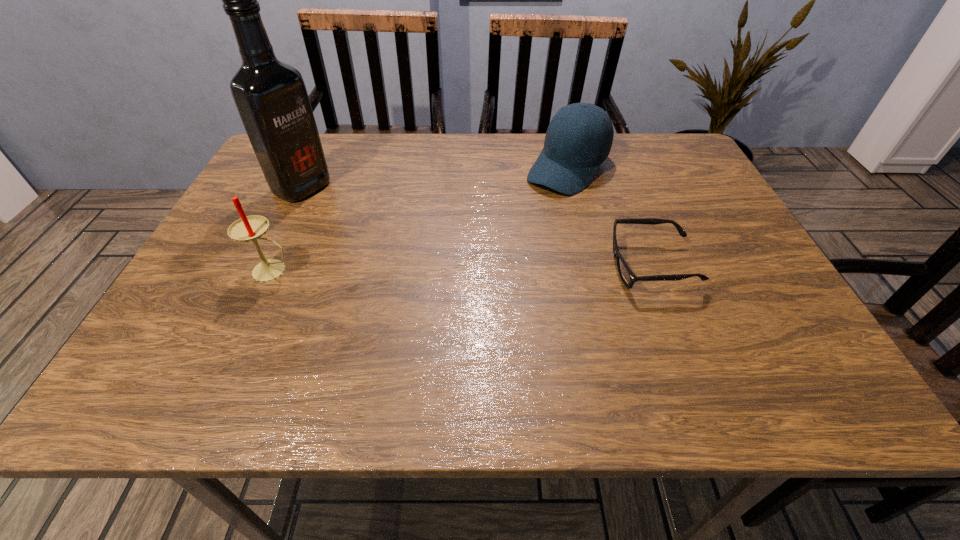
The width and height of the screenshot is (960, 540). Find the location of `free spot that satisfies the following two spatial constraints: 1. on the back side of the liquor; 2. on the left side of the second shortest object`. free spot that satisfies the following two spatial constraints: 1. on the back side of the liquor; 2. on the left side of the second shortest object is located at coordinates (311, 168).

Where is `vacant region that satisfies the following two spatial constraints: 1. on the front side of the candle; 2. on the left side of the liquor`? vacant region that satisfies the following two spatial constraints: 1. on the front side of the candle; 2. on the left side of the liquor is located at coordinates (261, 271).

This screenshot has height=540, width=960. What are the coordinates of `vacant space that satisfies the following two spatial constraints: 1. on the back side of the third shortest object; 2. on the right side of the second shortest object` in the screenshot? It's located at (320, 168).

This screenshot has width=960, height=540. In order to click on free space that satisfies the following two spatial constraints: 1. on the front side of the tallest object; 2. on the front-facing side of the sunglasses in this screenshot , I will do `click(263, 266)`.

Locate an element on the screen. free space that satisfies the following two spatial constraints: 1. on the front side of the sunglasses; 2. on the front-facing side of the tallest object is located at coordinates (263, 266).